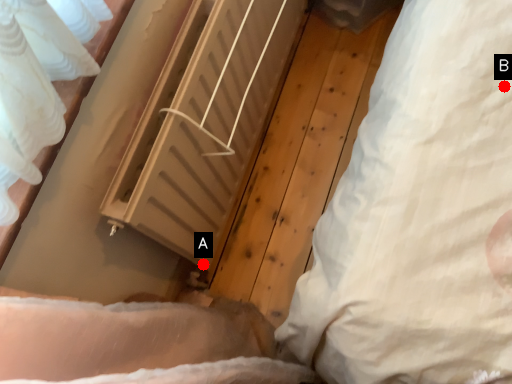
Question: Two points are circled on the image, labeled by A and B beside each circle. Which point is closer to the camera?

Choices:
 (A) A is closer
 (B) B is closer

Answer: (B)